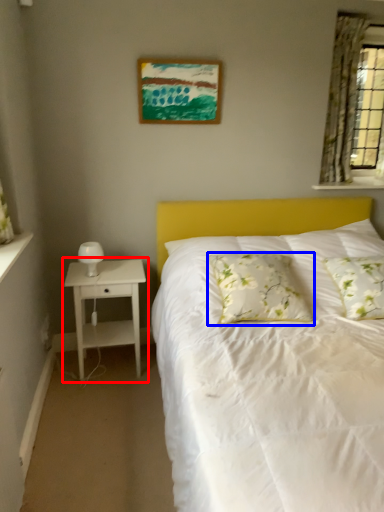
Question: Which of the following is the farthest to the observer, nightstand (highlighted by a red box) or pillow (highlighted by a blue box)?

Choices:
 (A) nightstand
 (B) pillow

Answer: (A)